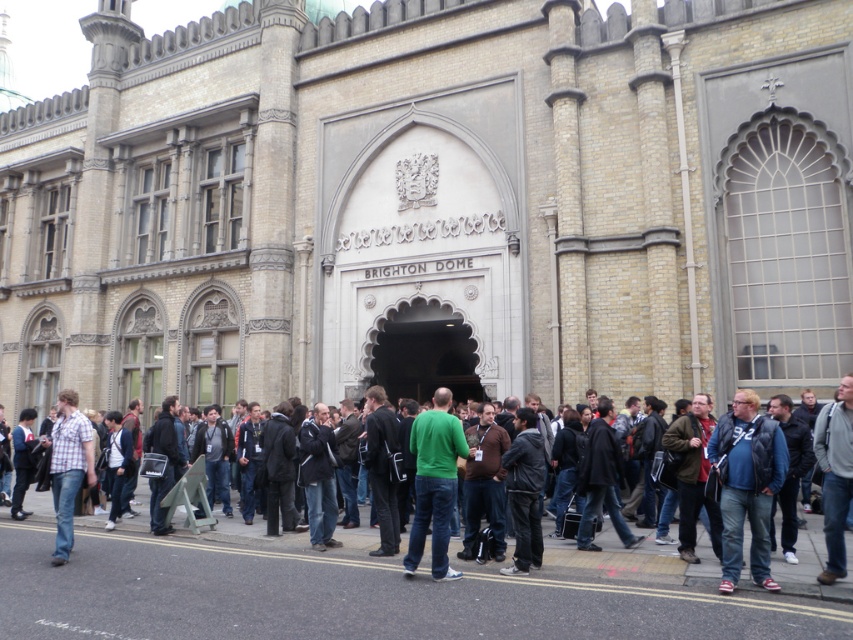
Question: Estimate the real-world distances between objects in this image. Which object is farther from the green matte shirt at center?

Choices:
 (A) plaid shirt at center
 (B) gray cotton jacket at center
 (C) matte blue jacket at center
 (D) black asphalt road at lower center

Answer: (A)

Question: Considering the real-world distances, which object is closest to the green matte shirt at center?

Choices:
 (A) green sweater at center
 (B) gray cotton jacket at center
 (C) plaid shirt at center
 (D) black asphalt road at lower center

Answer: (A)

Question: Is black asphalt road at lower center below matte blue jacket at center?

Choices:
 (A) no
 (B) yes

Answer: (B)

Question: Can you confirm if matte blue jacket at center is thinner than gray cotton jacket at center?

Choices:
 (A) no
 (B) yes

Answer: (B)

Question: Which of the following is the farthest from the observer?

Choices:
 (A) green matte shirt at center
 (B) green sweater at center

Answer: (A)

Question: Does green sweater at center appear over green matte shirt at center?

Choices:
 (A) no
 (B) yes

Answer: (A)